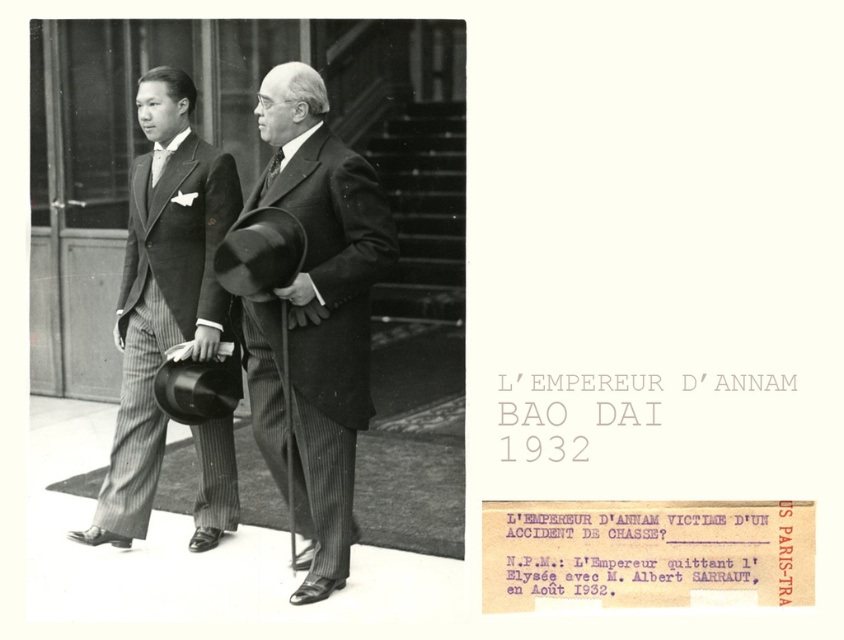
Between matte black suit at center and matte black suit at left, which one appears on the right side from the viewer's perspective?

From the viewer's perspective, matte black suit at center appears more on the right side.

Can you confirm if matte black suit at center is positioned to the left of matte black suit at left?

In fact, matte black suit at center is to the right of matte black suit at left.

Between point (333, 445) and point (138, 468), which one is positioned behind?

Point (138, 468)

At what (x,y) coordinates should I click in order to perform the action: click on matte black suit at center. Please return your answer as a coordinate pair (x, y). The width and height of the screenshot is (844, 640). Looking at the image, I should click on (309, 314).

The height and width of the screenshot is (640, 844). What do you see at coordinates (309, 314) in the screenshot?
I see `matte black suit at center` at bounding box center [309, 314].

Does matte black suit at center appear on the left side of matte black tie at center?

In fact, matte black suit at center is to the right of matte black tie at center.

The width and height of the screenshot is (844, 640). I want to click on matte black suit at center, so click(x=309, y=314).

Does matte black suit at center appear on the right side of matte black tie at left?

Correct, you'll find matte black suit at center to the right of matte black tie at left.

Is matte black suit at center further to camera compared to matte black tie at left?

No, it is in front of matte black tie at left.

Locate an element on the screen. The image size is (844, 640). matte black suit at center is located at coordinates (309, 314).